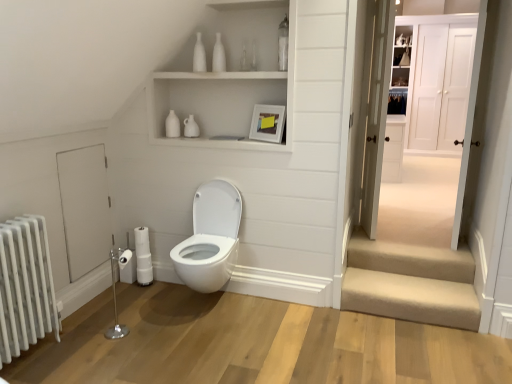
This screenshot has height=384, width=512. What are the coordinates of `beige carpeted stairs at lower right` in the screenshot? It's located at (411, 282).

This screenshot has width=512, height=384. What do you see at coordinates (25, 286) in the screenshot? I see `white marble radiator at left` at bounding box center [25, 286].

In the scene shown: What is the approximate height of white marble radiator at left?

white marble radiator at left is 84.19 centimeters in height.

In order to click on white matte door at left, marked as the 4th door in a back-to-front arrangement in this screenshot , I will do `click(85, 208)`.

Describe the element at coordinates (432, 121) in the screenshot. I see `white wooden door at upper right, the third door in the left-to-right sequence` at that location.

Where is `white glossy door at right, the third door positioned from the right`? white glossy door at right, the third door positioned from the right is located at coordinates (376, 113).

This screenshot has height=384, width=512. I want to click on white glossy toilet at center, so click(210, 238).

Is the position of white glossy toilet at center less distant than that of white matte toilet paper at lower left?

Yes, white glossy toilet at center is closer to the camera.

Considering the relative sizes of white glossy toilet at center and white matte toilet paper at lower left in the image provided, is white glossy toilet at center wider than white matte toilet paper at lower left?

Yes.

Is white glossy toilet at center not near white matte toilet paper at lower left?

white glossy toilet at center is actually quite close to white matte toilet paper at lower left.

Considering the sizes of objects white glossy toilet at center and white matte toilet paper at lower left in the image provided, who is taller, white glossy toilet at center or white matte toilet paper at lower left?

Standing taller between the two is white glossy toilet at center.

Is white wood door at upper right, positioned as the 4th door in front-to-back order, oriented away from white glossy toilet at center?

No, white glossy toilet at center is not at the back of white wood door at upper right, positioned as the 4th door in front-to-back order.

Is the depth of white wood door at upper right, positioned as the 4th door in front-to-back order, greater than that of white glossy toilet at center?

Yes, it is.

Is point (453, 56) in front of point (195, 251)?

No.

From a real-world perspective, is white matte toilet paper at lower left under white glossy door at right, the 3th door positioned from the back?

Indeed, from a real-world perspective, white matte toilet paper at lower left is positioned beneath white glossy door at right, the 3th door positioned from the back.

From the image's perspective, relative to white glossy door at right, the third door positioned from the right, is white matte toilet paper at lower left above or below?

white matte toilet paper at lower left is situated lower than white glossy door at right, the third door positioned from the right, in the image.

From a real-world perspective, which door is the 3rd one above the white matte toilet paper at lower left? Please provide its 2D coordinates.

[(376, 113)]

Choose the correct answer: Is white matte toilet paper at lower left inside white glossy door at right, which is counted as the second door, starting from the front, or outside it?

white matte toilet paper at lower left is not enclosed by white glossy door at right, which is counted as the second door, starting from the front.

Is white glossy toilet at center aimed at white glossy door at right, the 3th door positioned from the back?

No.

Is white glossy toilet at center positioned in front of white glossy door at right, which is counted as the second door, starting from the front?

Yes, white glossy toilet at center is closer to the viewer.

Is white glossy toilet at center completely or partially outside of white glossy door at right, the third door positioned from the right?

Absolutely, white glossy toilet at center is external to white glossy door at right, the third door positioned from the right.

What's the angular difference between white matte door at left, positioned as the first door in front-to-back order, and white glossy toilet at center's facing directions?

94 degrees separate the facing orientations of white matte door at left, positioned as the first door in front-to-back order, and white glossy toilet at center.

From a real-world perspective, between white matte door at left, which ranks as the fourth door in right-to-left order, and white glossy toilet at center, who is vertically lower?

In real-world perspective, white glossy toilet at center is lower.

From the image's perspective, between white matte door at left, the first door in the left-to-right sequence, and white glossy toilet at center, which one is located above?

white matte door at left, the first door in the left-to-right sequence, appears higher in the image.

From the image's perspective, is white wood door at upper right, positioned as the 4th door in front-to-back order, located above or below white wooden door at upper right, the 2th door from the back?

white wood door at upper right, positioned as the 4th door in front-to-back order, is situated higher than white wooden door at upper right, the 2th door from the back, in the image.

Considering the sizes of white wood door at upper right, the first door viewed from the right, and white wooden door at upper right, the third door in the left-to-right sequence, in the image, is white wood door at upper right, the first door viewed from the right, wider or thinner than white wooden door at upper right, the third door in the left-to-right sequence,?

white wood door at upper right, the first door viewed from the right, is thinner than white wooden door at upper right, the third door in the left-to-right sequence.

From a real-world perspective, is white wood door at upper right, which is the first door from back to front, physically located above or below white wooden door at upper right, which is counted as the third door, starting from the front?

white wood door at upper right, which is the first door from back to front, is above white wooden door at upper right, which is counted as the third door, starting from the front.

Based on the photo, considering the positions of objects white matte toilet paper at lower left and white matte door at left, which ranks as the fourth door in right-to-left order, in the image provided, who is behind, white matte toilet paper at lower left or white matte door at left, which ranks as the fourth door in right-to-left order,?

white matte toilet paper at lower left.

Which is nearer, (124,270) or (80,229)?

Point (124,270).

Which of these two, white matte toilet paper at lower left or white matte door at left, which ranks as the fourth door in right-to-left order, is smaller?

With smaller size is white matte toilet paper at lower left.

Does white matte toilet paper at lower left appear on the right side of white matte door at left, positioned as the first door in front-to-back order?

Correct, you'll find white matte toilet paper at lower left to the right of white matte door at left, positioned as the first door in front-to-back order.

At what (x,y) coordinates should I click in order to perform the action: click on toilet paper below the white glossy toilet at center (from the image's perspective). Please return your answer as a coordinate pair (x, y). This screenshot has height=384, width=512. Looking at the image, I should click on (127, 266).

From a real-world perspective, starting from the white glossy toilet at center, which door is the 4th one vertically above it? Please provide its 2D coordinates.

[(441, 86)]

Considering their positions, is white marble radiator at left positioned further to white wood door at upper right, the first door viewed from the right, than white glossy toilet at center?

white marble radiator at left is positioned further to the anchor white wood door at upper right, the first door viewed from the right.

Looking at the image, which one is located closer to white matte door at left, the first door in the left-to-right sequence, white glossy door at right, the third door positioned from the right, or white marble radiator at left?

white marble radiator at left is closer to white matte door at left, the first door in the left-to-right sequence.

Based on their spatial positions, is white marble radiator at left or white matte toilet paper at lower left further from white wood door at upper right, positioned as the 4th door in front-to-back order?

white marble radiator at left lies further to white wood door at upper right, positioned as the 4th door in front-to-back order, than the other object.

When comparing their distances from white marble radiator at left, does beige carpeted stairs at lower right or white wooden door at upper right, positioned as the second door in right-to-left order, seem closer?

beige carpeted stairs at lower right is positioned closer to the anchor white marble radiator at left.

Looking at this image, considering their positions, is white wood door at upper right, positioned as the 4th door in front-to-back order, positioned closer to beige carpeted stairs at lower right than white matte toilet paper at lower left?

Based on the image, white matte toilet paper at lower left appears to be nearer to beige carpeted stairs at lower right.

From the image, which object appears to be nearer to beige carpeted stairs at lower right, white glossy door at right, the 3th door positioned from the back, or white wood door at upper right, which ranks as the fourth door in left-to-right order?

white glossy door at right, the 3th door positioned from the back, is positioned closer to the anchor beige carpeted stairs at lower right.

When comparing their distances from white matte toilet paper at lower left, does white marble radiator at left or beige carpeted stairs at lower right seem further?

The object further to white matte toilet paper at lower left is beige carpeted stairs at lower right.

When comparing their distances from white glossy door at right, which is counted as the second door, starting from the front, does white wood door at upper right, the first door viewed from the right, or white matte door at left, the first door in the left-to-right sequence, seem closer?

The object closer to white glossy door at right, which is counted as the second door, starting from the front, is white matte door at left, the first door in the left-to-right sequence.

Where is `door situated between white matte door at left, positioned as the first door in front-to-back order, and white wooden door at upper right, which is counted as the third door, starting from the front, from left to right`? Image resolution: width=512 pixels, height=384 pixels. door situated between white matte door at left, positioned as the first door in front-to-back order, and white wooden door at upper right, which is counted as the third door, starting from the front, from left to right is located at coordinates (376, 113).

Find the location of `stairwell located between white marble radiator at left and white wood door at upper right, positioned as the 4th door in front-to-back order, in the depth direction`. stairwell located between white marble radiator at left and white wood door at upper right, positioned as the 4th door in front-to-back order, in the depth direction is located at coordinates (411, 282).

You are a GUI agent. You are given a task and a screenshot of the screen. Output one action in this format:
    pyautogui.click(x=<x>, y=<y>)
    Task: Click on the toilet between white matte toilet paper at lower left and white wooden door at upper right, positioned as the second door in right-to-left order, in the horizontal direction
    The image size is (512, 384).
    Given the screenshot: What is the action you would take?
    pyautogui.click(x=210, y=238)

Where is `toilet between white matte door at left, positioned as the first door in front-to-back order, and white glossy door at right, which is counted as the second door, starting from the front, in the horizontal direction`? toilet between white matte door at left, positioned as the first door in front-to-back order, and white glossy door at right, which is counted as the second door, starting from the front, in the horizontal direction is located at coordinates (210, 238).